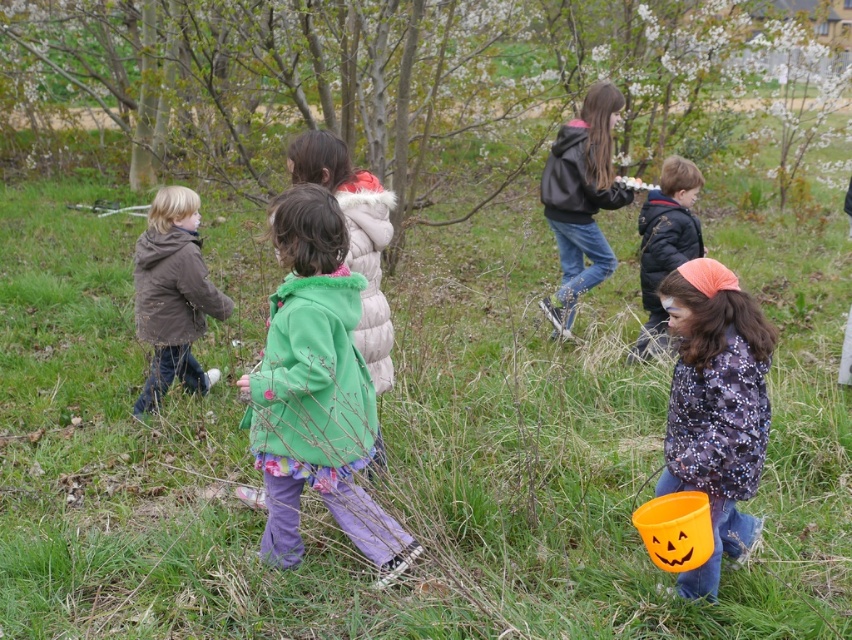
You are a photographer trying to capture a group shot of the children in the image. You want to position yourself at the point marked by the coordinates point (315, 390). Which child should you focus on to ensure they are centered in your photo?

The point (315, 390) indicates the green fuzzy coat at center, so you should focus on the child wearing the green fuzzy coat at center to ensure they are centered in your photo.

You are a photographer trying to capture a group photo of the children. You need to ensure that the brown matte jacket at left and the dark blue jacket at center are both visible in the frame. Based on their positions, which jacket should you focus on first to ensure both are in the shot?

The brown matte jacket at left is positioned on the left side of the dark blue jacket at center. To include both in the frame, focus on the dark blue jacket at center first, as it is closer to the center and the brown matte jacket at left will naturally be included to its left.